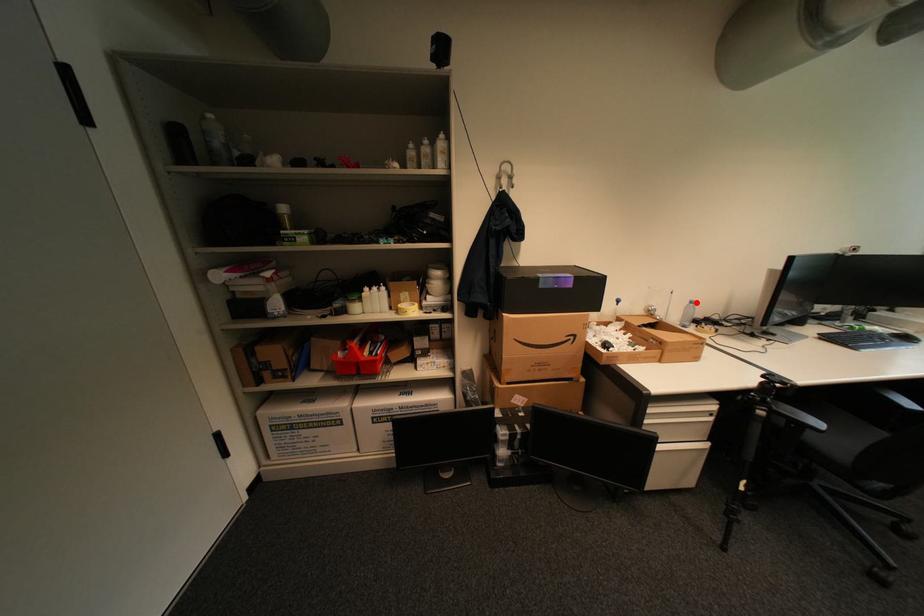
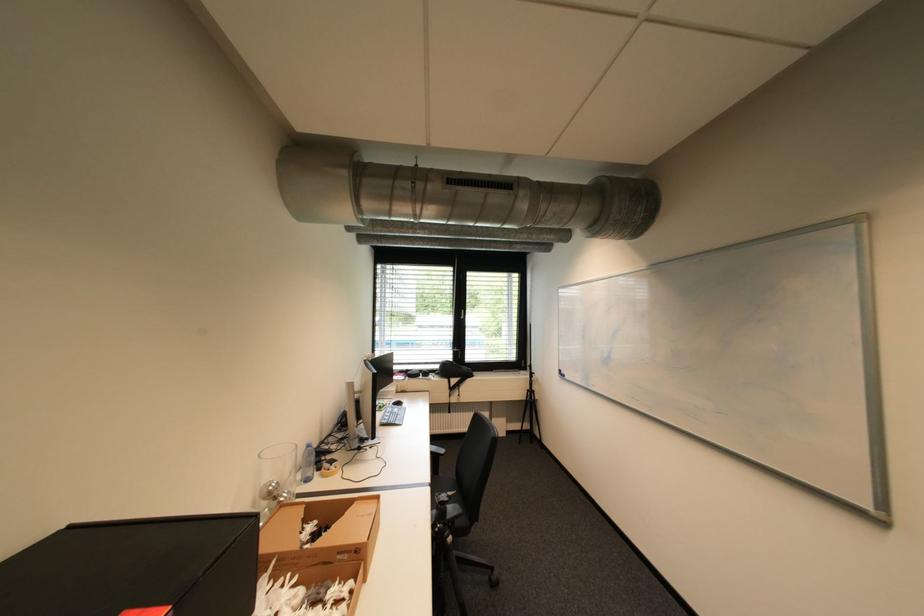
Question: I am providing you with two images of the same scene from different viewpoints. Given a red point in image1, look at the same physical point in image2. Is it:

Choices:
 (A) Closer to the viewpoint
 (B) Farther from the viewpoint

Answer: (A)